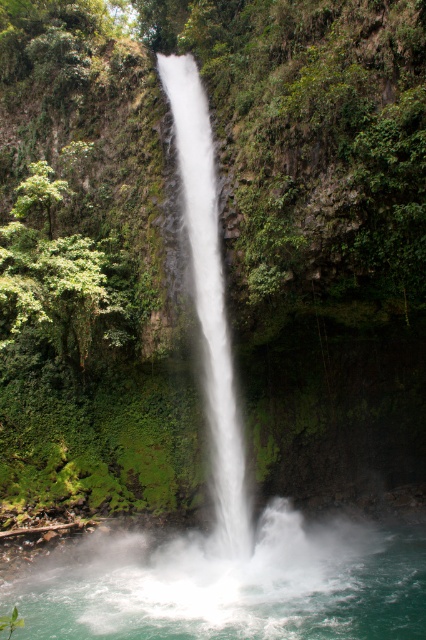
You are a photographer planning to capture the waterfall. You notice two types of water in the scene. Which one is smaller in size between the clear water at center and the white frothy water at center?

The clear water at center is smaller than the white frothy water at center according to the description.